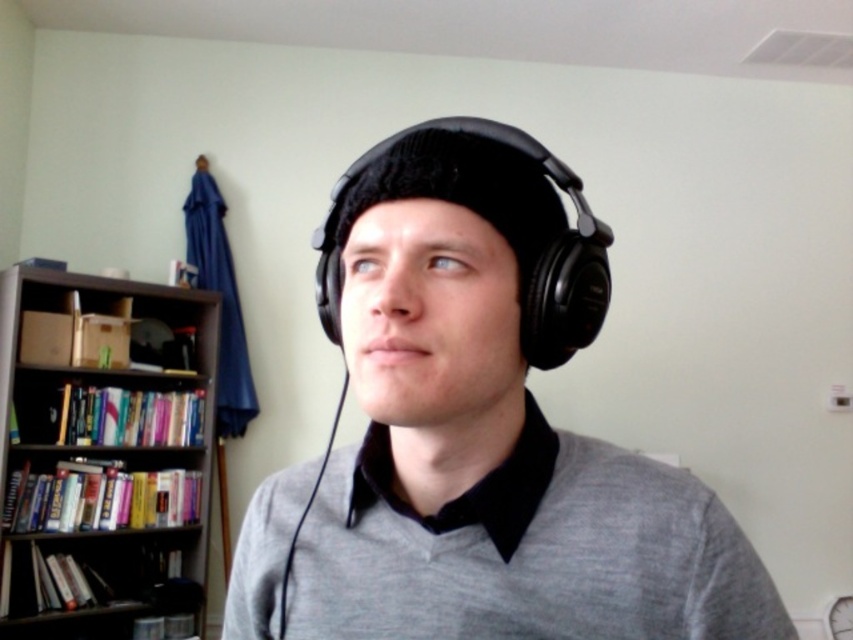
Can you confirm if matte black headphones at center is positioned below gray cotton sweater at center?

No, matte black headphones at center is not below gray cotton sweater at center.

Is point (410, 355) farther from camera compared to point (544, 600)?

No, (410, 355) is closer to viewer.

This screenshot has height=640, width=853. Find the location of `matte black headphones at center`. matte black headphones at center is located at coordinates (479, 433).

Does matte black headphones at center have a lesser width compared to dark wood bookcase at left?

Correct, matte black headphones at center's width is less than dark wood bookcase at left's.

How much distance is there between matte black headphones at center and dark wood bookcase at left?

They are 2.35 meters apart.

Is point (448, 218) positioned after point (123, 390)?

No, it is not.

Find the location of a particular element. matte black headphones at center is located at coordinates (479, 433).

Based on the photo, which is more to the right, gray cotton sweater at center or dark wood bookcase at left?

gray cotton sweater at center

Is point (445, 604) positioned behind point (146, 483)?

No, it is not.

The width and height of the screenshot is (853, 640). What do you see at coordinates (527, 552) in the screenshot? I see `gray cotton sweater at center` at bounding box center [527, 552].

Where is `gray cotton sweater at center`? This screenshot has width=853, height=640. gray cotton sweater at center is located at coordinates (527, 552).